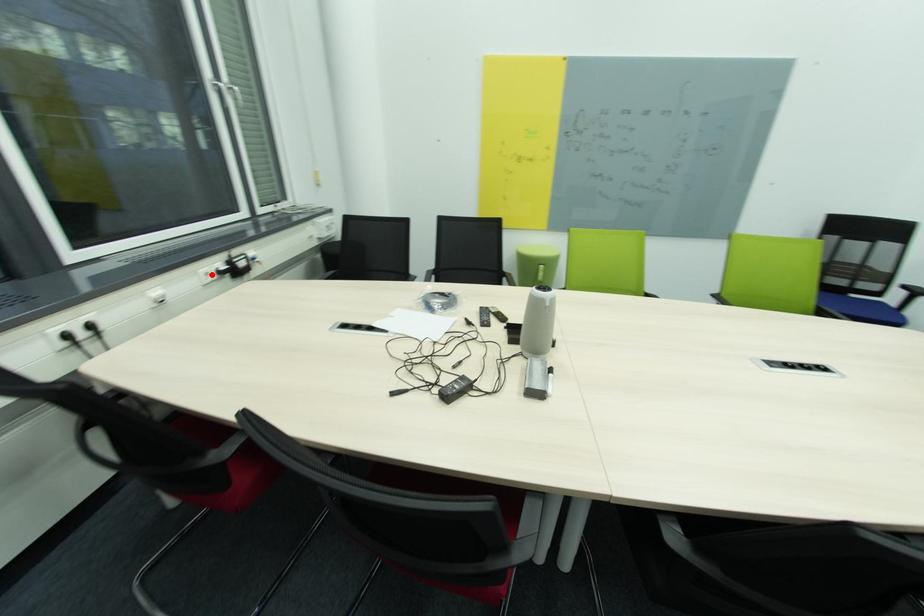
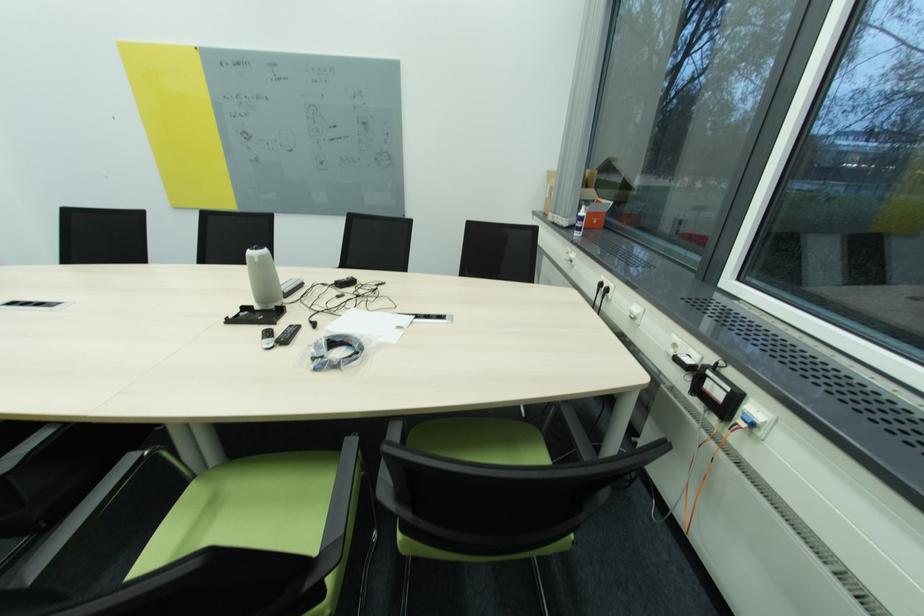
Locate, in the second image, the point that corresponds to the highlighted location in the first image.

(679, 346)